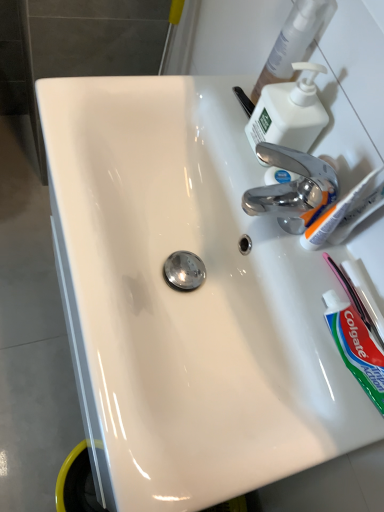
Question: Does pink plastic toothbrush at lower right, which is the first toothbrush from bottom to top, contain green matte toothpaste at lower right?

Choices:
 (A) yes
 (B) no

Answer: (B)

Question: Is pink plastic toothbrush at lower right, the second toothbrush when ordered from top to bottom, smaller than green matte toothpaste at lower right?

Choices:
 (A) yes
 (B) no

Answer: (A)

Question: Is pink plastic toothbrush at lower right, which appears as the 2th toothbrush when viewed from the left, not close to green matte toothpaste at lower right?

Choices:
 (A) no
 (B) yes

Answer: (A)

Question: Is pink plastic toothbrush at lower right, the second toothbrush when ordered from top to bottom, to the left of green matte toothpaste at lower right from the viewer's perspective?

Choices:
 (A) yes
 (B) no

Answer: (B)

Question: Is pink plastic toothbrush at lower right, the second toothbrush when ordered from top to bottom, oriented towards green matte toothpaste at lower right?

Choices:
 (A) yes
 (B) no

Answer: (A)

Question: In terms of width, does white plastic toothbrush at upper right, the 1th toothbrush positioned from the left, look wider or thinner when compared to white plastic soap dispenser at upper right?

Choices:
 (A) thin
 (B) wide

Answer: (A)

Question: Is white plastic toothbrush at upper right, the 2th toothbrush positioned from the right, to the left or to the right of white plastic soap dispenser at upper right in the image?

Choices:
 (A) left
 (B) right

Answer: (B)

Question: Do you think white plastic toothbrush at upper right, the 2th toothbrush positioned from the right, is within white plastic soap dispenser at upper right, or outside of it?

Choices:
 (A) outside
 (B) inside

Answer: (A)

Question: From their relative heights in the image, would you say white plastic toothbrush at upper right, the 1th toothbrush positioned from the left, is taller or shorter than white plastic soap dispenser at upper right?

Choices:
 (A) tall
 (B) short

Answer: (A)

Question: From their relative heights in the image, would you say white plastic soap dispenser at upper right is taller or shorter than green matte toothpaste at lower right?

Choices:
 (A) tall
 (B) short

Answer: (A)

Question: Looking at the image, does white plastic soap dispenser at upper right seem bigger or smaller compared to green matte toothpaste at lower right?

Choices:
 (A) big
 (B) small

Answer: (A)

Question: From the image's perspective, is white plastic soap dispenser at upper right above or below green matte toothpaste at lower right?

Choices:
 (A) above
 (B) below

Answer: (A)

Question: Is point (261, 140) positioned closer to the camera than point (377, 382)?

Choices:
 (A) farther
 (B) closer

Answer: (A)

Question: Is green matte toothpaste at lower right situated inside pink plastic toothbrush at lower right, which ranks as the 1th toothbrush in right-to-left order, or outside?

Choices:
 (A) inside
 (B) outside

Answer: (B)

Question: From a real-world perspective, is green matte toothpaste at lower right above or below pink plastic toothbrush at lower right, which is the first toothbrush from bottom to top?

Choices:
 (A) below
 (B) above

Answer: (B)